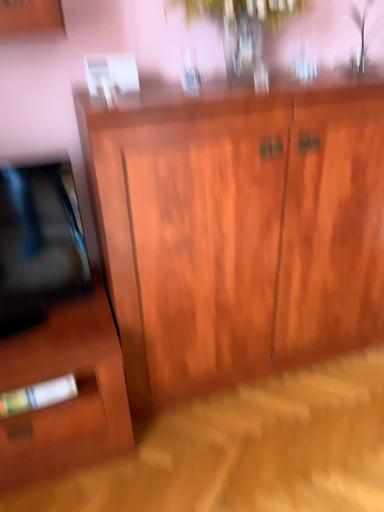
Question: Is matte wood side cabinet at lower left in front of or behind wooden cabinet at center in the image?

Choices:
 (A) behind
 (B) front

Answer: (A)

Question: From their relative heights in the image, would you say matte wood side cabinet at lower left is taller or shorter than wooden cabinet at center?

Choices:
 (A) tall
 (B) short

Answer: (B)

Question: From a real-world perspective, is matte wood side cabinet at lower left physically located above or below wooden cabinet at center?

Choices:
 (A) above
 (B) below

Answer: (B)

Question: In terms of size, does wooden cabinet at center appear bigger or smaller than matte wood side cabinet at lower left?

Choices:
 (A) big
 (B) small

Answer: (A)

Question: Based on their positions, is wooden cabinet at center located to the left or right of matte wood side cabinet at lower left?

Choices:
 (A) left
 (B) right

Answer: (B)

Question: Is wooden cabinet at center in front of or behind matte wood side cabinet at lower left in the image?

Choices:
 (A) front
 (B) behind

Answer: (A)

Question: Which is correct: wooden cabinet at center is inside matte wood side cabinet at lower left, or outside of it?

Choices:
 (A) inside
 (B) outside

Answer: (B)